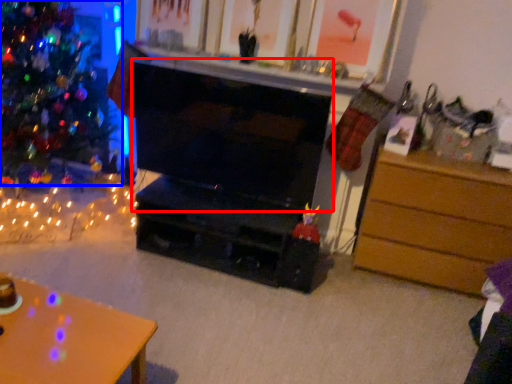
Question: Which of the following is the farthest to the observer, fireplace (highlighted by a red box) or christmas tree (highlighted by a blue box)?

Choices:
 (A) fireplace
 (B) christmas tree

Answer: (A)